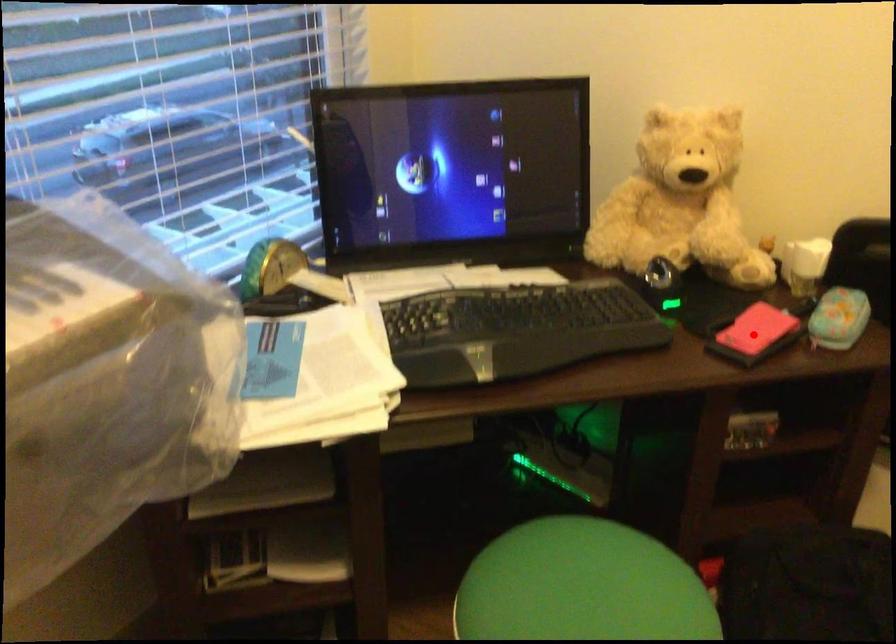
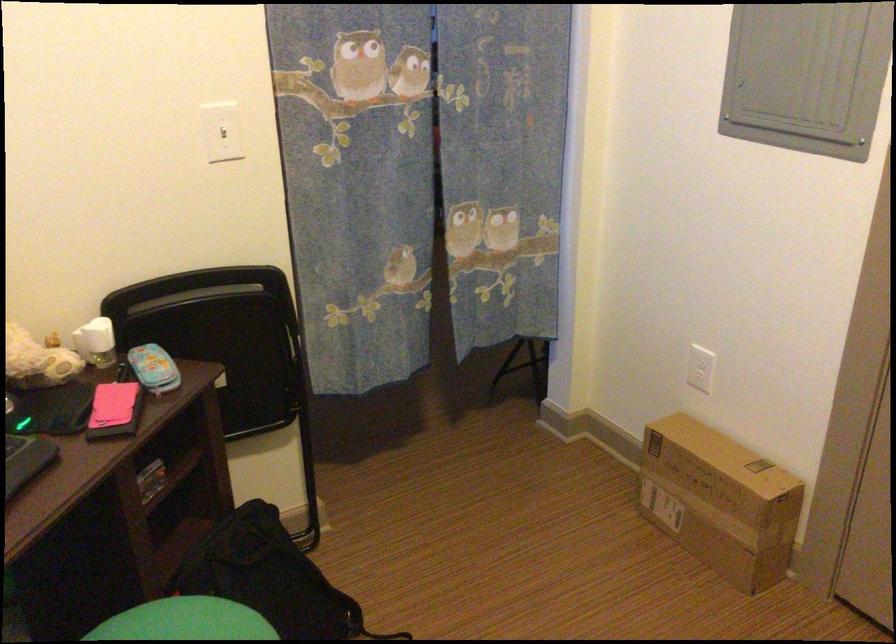
Where in the second image is the point corresponding to the highlighted location from the first image?

(114, 410)